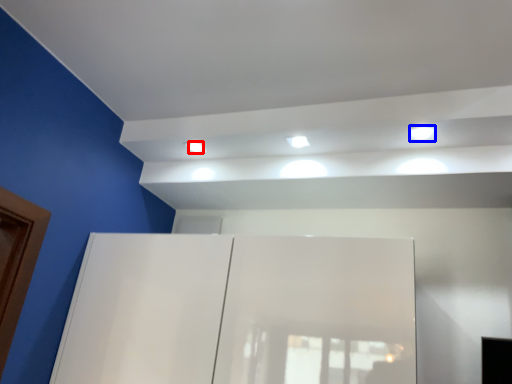
Question: Which object is further to the camera taking this photo, dot (highlighted by a red box) or light (highlighted by a blue box)?

Choices:
 (A) dot
 (B) light

Answer: (A)